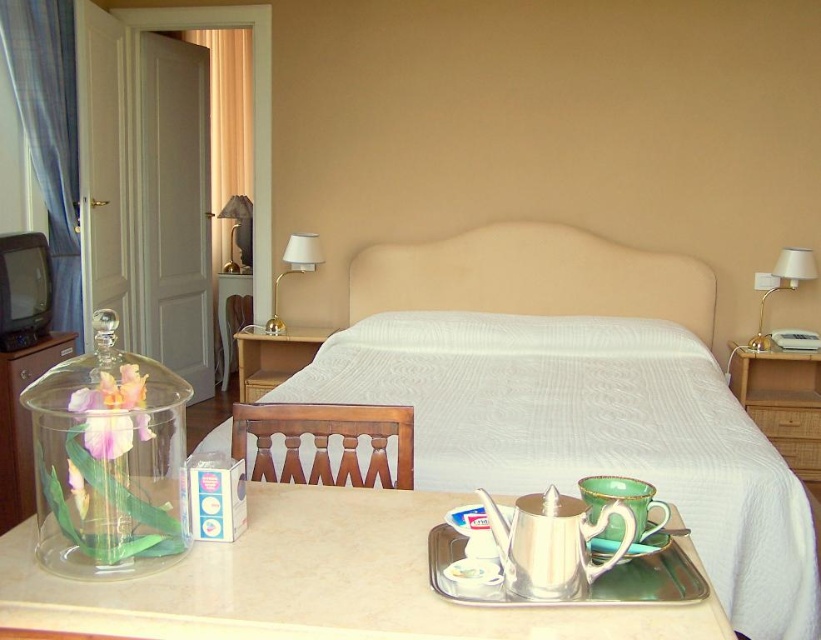
Question: Which object appears closest to the camera in this image?

Choices:
 (A) white fabric bed at center
 (B) white glossy lamp at upper right
 (C) metallic gold lamp at upper left

Answer: (A)

Question: Does translucent glass vase at lower left appear over metallic gold lamp at upper left?

Choices:
 (A) no
 (B) yes

Answer: (A)

Question: Does beige fabric headboard at center appear under green ceramic saucer at lower center?

Choices:
 (A) no
 (B) yes

Answer: (A)

Question: Which of the following is the closest to the observer?

Choices:
 (A) click(x=803, y=358)
 (B) click(x=622, y=324)

Answer: (A)

Question: Which point is farther from the camera taking this photo?

Choices:
 (A) (732, 385)
 (B) (136, 387)

Answer: (A)

Question: Can you confirm if translucent glass vase at lower left is positioned below green ceramic saucer at lower center?

Choices:
 (A) yes
 (B) no

Answer: (B)